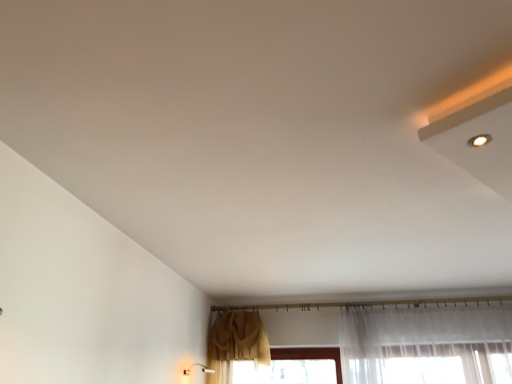
Identify the location of white plastic light fixture at lower left. This screenshot has width=512, height=384. (201, 368).

Based on the photo, what is the approximate height of white plastic light fixture at lower left?

It is 4.36 inches.

Describe the element at coordinates (201, 368) in the screenshot. I see `white plastic light fixture at lower left` at that location.

You are a GUI agent. You are given a task and a screenshot of the screen. Output one action in this format:
    pyautogui.click(x=<x>, y=<y>)
    Task: Click on the white plastic light fixture at lower left
    
    Given the screenshot: What is the action you would take?
    [x=201, y=368]